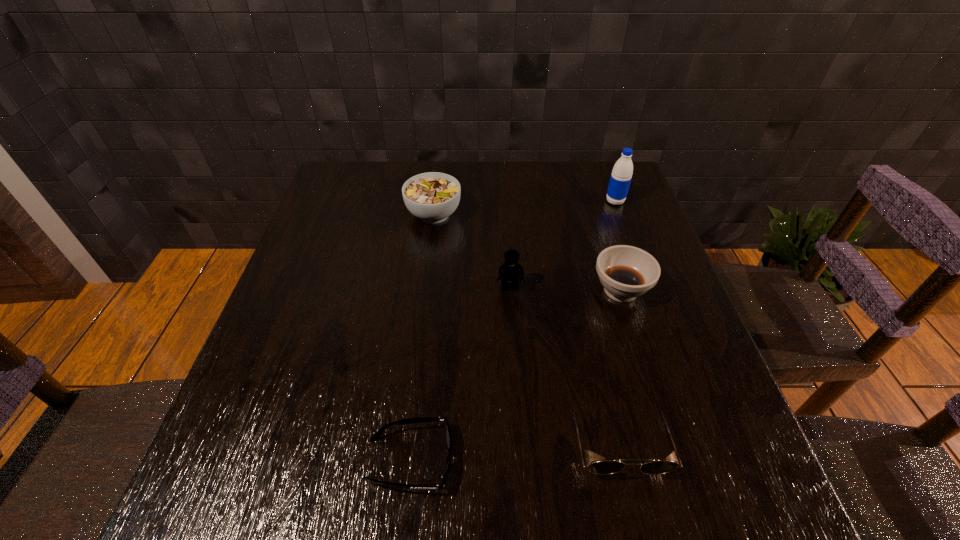
Identify the location of the tallest object. The image size is (960, 540). (621, 175).

Locate an element on the screen. The width and height of the screenshot is (960, 540). the fourth object from right to left is located at coordinates (510, 271).

Find the location of a particular element. Image resolution: width=960 pixels, height=540 pixels. the fifth shortest object is located at coordinates (510, 271).

What are the coordinates of `the farther soup bowl` in the screenshot? It's located at pyautogui.click(x=432, y=197).

Where is `the nearer soup bowl`? The height and width of the screenshot is (540, 960). the nearer soup bowl is located at coordinates (626, 272).

Identify the location of the taller sunglasses. The image size is (960, 540). (655, 467).

Locate an element on the screen. Image resolution: width=960 pixels, height=540 pixels. the left sunglasses is located at coordinates (426, 419).

Find the location of a particular element. The width and height of the screenshot is (960, 540). the shorter sunglasses is located at coordinates (426, 419).

Find the location of `vacant area located on the front of the water bottle`. vacant area located on the front of the water bottle is located at coordinates (634, 251).

Where is `vacant space situated 0.380m on the front-facing side of the Lego`? vacant space situated 0.380m on the front-facing side of the Lego is located at coordinates (521, 457).